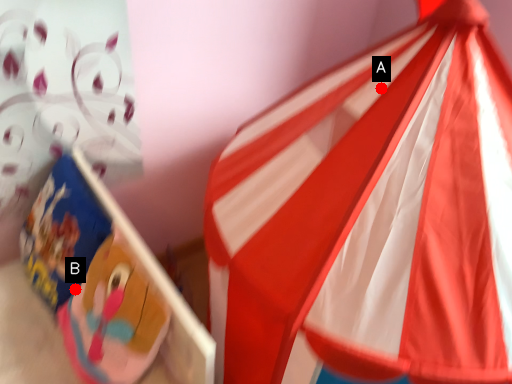
Question: Two points are circled on the image, labeled by A and B beside each circle. Which point appears farthest from the camera in this image?

Choices:
 (A) A is further
 (B) B is further

Answer: (B)